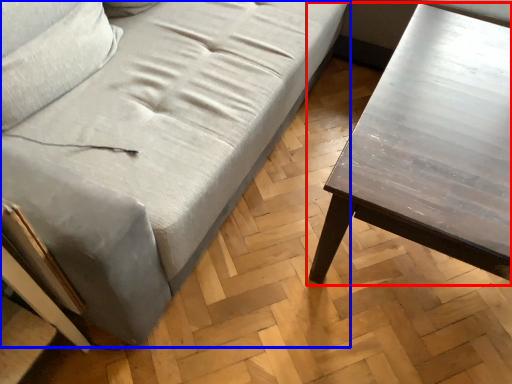
Question: Which object appears closest to the camera in this image, table (highlighted by a red box) or studio couch (highlighted by a blue box)?

Choices:
 (A) table
 (B) studio couch

Answer: (B)